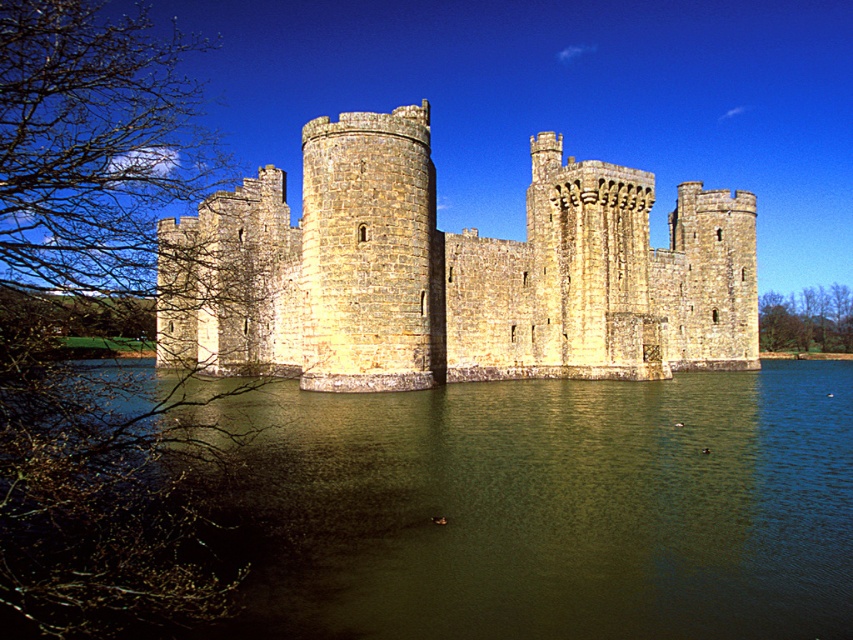
You are a photographer planning to capture the stone castle at center and the greenish water at center in a single shot. Given that the camera can only focus on one object at a time, which object should you prioritize focusing on to ensure it appears larger in the final photograph?

The stone castle at center should be prioritized for focusing since it is larger than the greenish water at center, ensuring it appears prominent in the photograph.

You are standing at the point marked as point (492,589), which is 42.87 meters away from the viewer. If you want to walk towards the castle, which direction should you move relative to your current position?

Since you are 42.87 meters away from the viewer and the castle is the central structure in the scene, you should move towards the castle by heading in the direction opposite to the viewer. This will bring you closer to the castle.

You are standing on the island where the stone castle at center is located and looking towards the greenish water at center. Which direction should you walk to reach the water?

You should walk to your left since the greenish water at center is to the left of the stone castle at center.